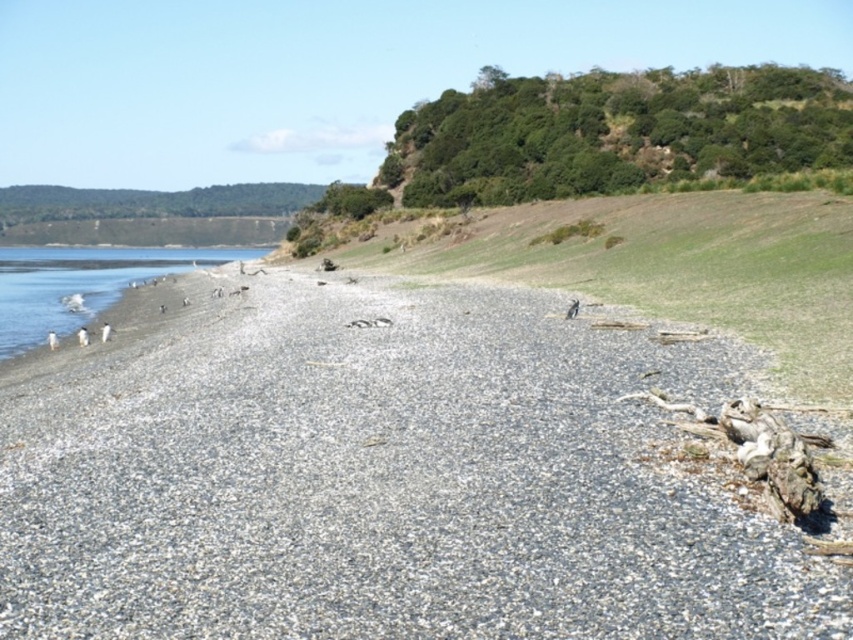
Can you confirm if gray gravelly sand at lower left is positioned below white sand at lower left?

Yes.

How much distance is there between gray gravelly sand at lower left and white sand at lower left?

66.28 meters

Measure the distance between point (119,465) and camera.

They are 16.00 meters apart.

Find the location of a particular element. This screenshot has height=640, width=853. gray gravelly sand at lower left is located at coordinates (379, 480).